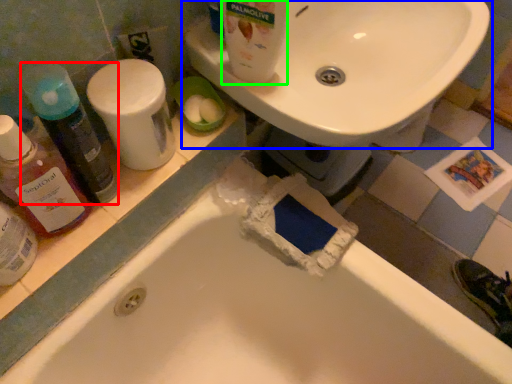
Question: Estimate the real-world distances between objects in this image. Which object is farther from cleaning product (highlighted by a red box), sink (highlighted by a blue box) or cleaning product (highlighted by a green box)?

Choices:
 (A) sink
 (B) cleaning product

Answer: (A)